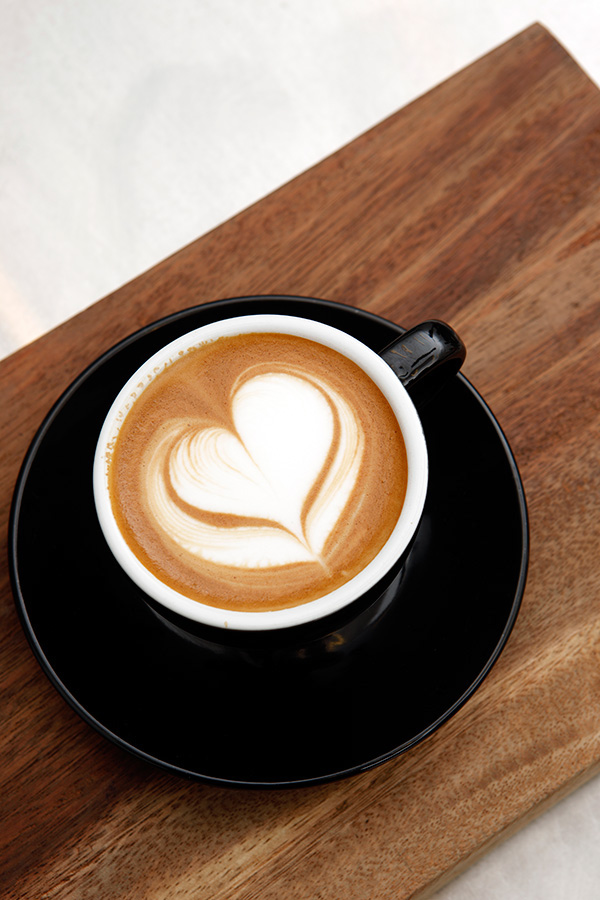
Identify the location of rim of mug. Image resolution: width=600 pixels, height=900 pixels. click(x=291, y=618).